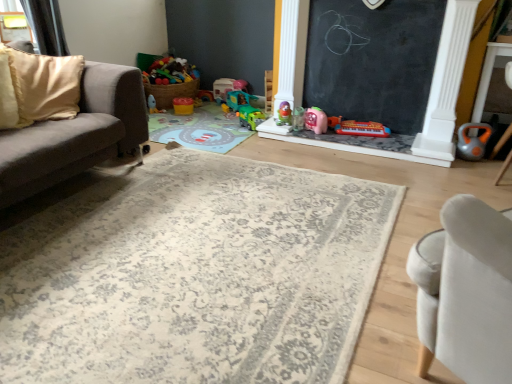
Image resolution: width=512 pixels, height=384 pixels. I want to click on vacant region to the left of green plastic toy car at center, which ranks as the fifth toy in left-to-right order, so click(229, 124).